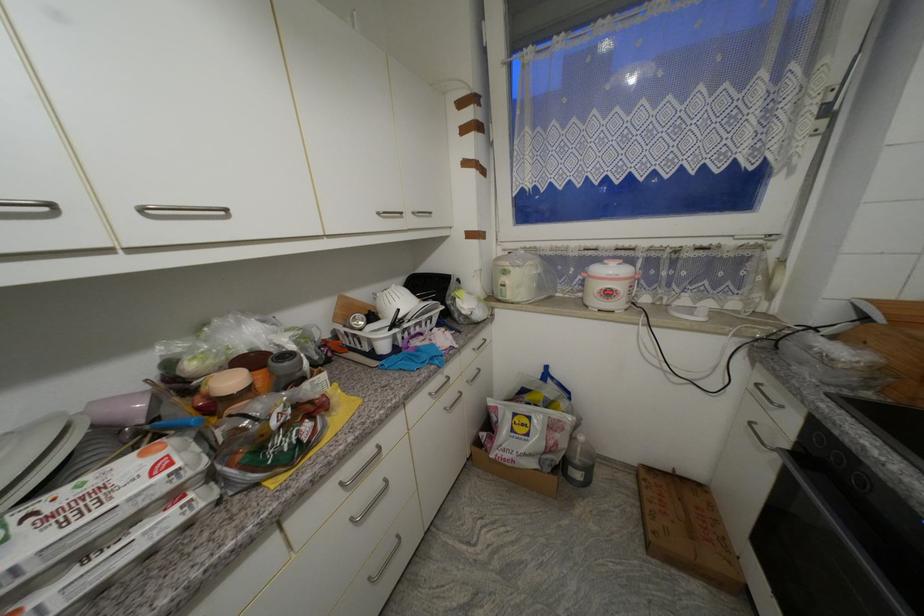
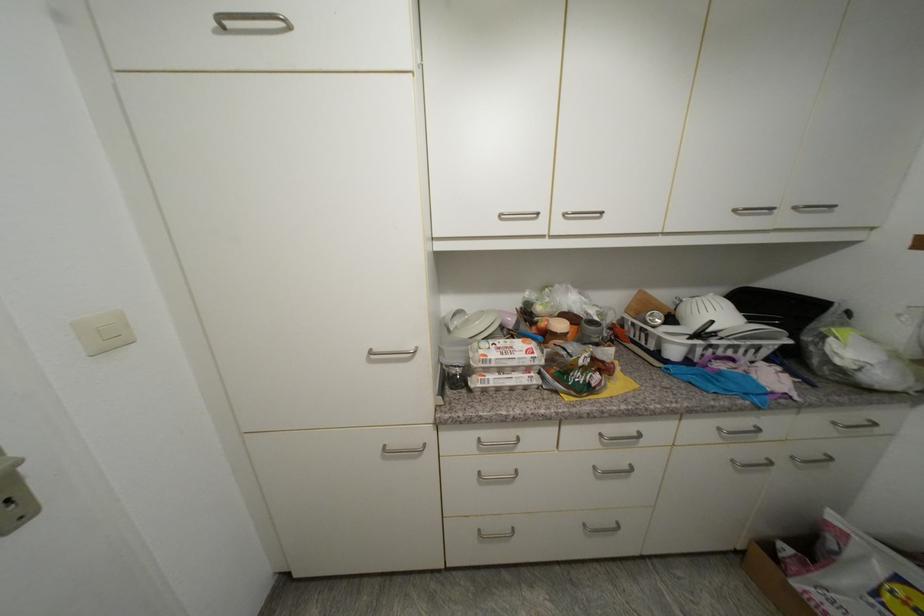
Where in the second image is the point corresponding to [451,410] from the first image?

(738, 463)